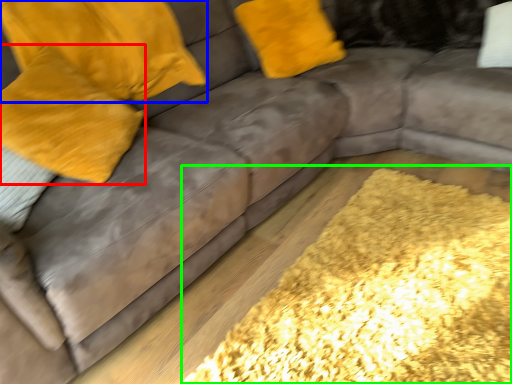
Question: Which object is the closest to the pillow (highlighted by a red box)? Choose among these: pillow (highlighted by a blue box) or mat (highlighted by a green box).

Choices:
 (A) pillow
 (B) mat

Answer: (A)